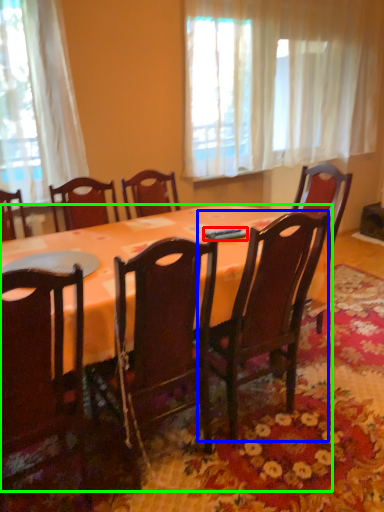
Question: Considering the real-world distances, which object is farthest from remote control (highlighted by a red box)? chair (highlighted by a blue box) or kitchen & dining room table (highlighted by a green box)?

Choices:
 (A) chair
 (B) kitchen & dining room table

Answer: (B)